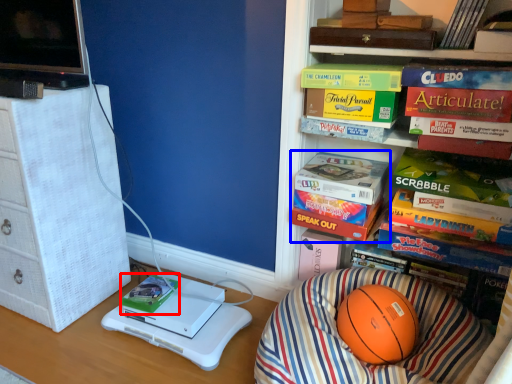
Question: Which of the following is the closest to the observer, book (highlighted by a red box) or book (highlighted by a blue box)?

Choices:
 (A) book
 (B) book

Answer: (B)